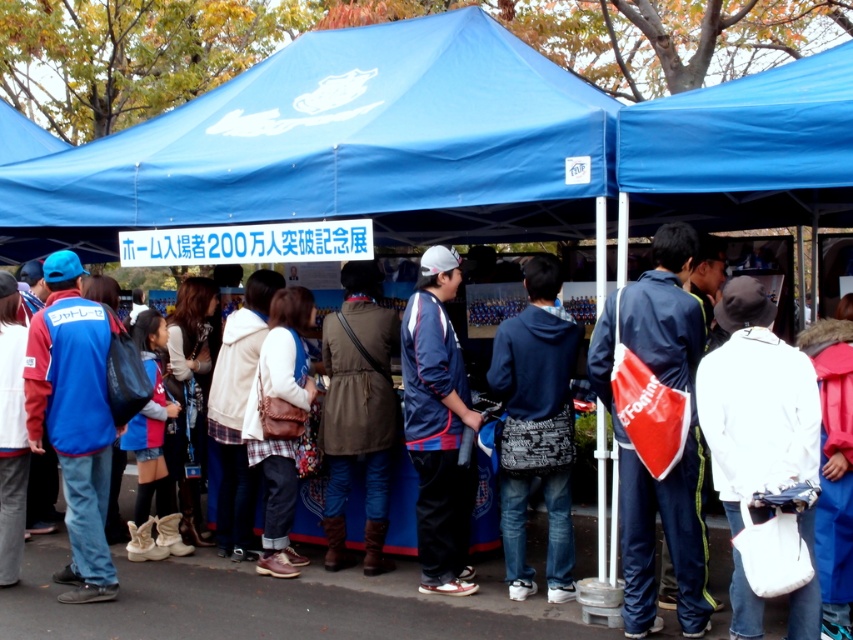
Question: Among these objects, which one is farthest from the camera?

Choices:
 (A) blue fabric canopy at center
 (B) leather brown bag at center
 (C) blue fabric jacket at center

Answer: (B)

Question: Which of these objects is positioned closest to the brown leather jacket at center?

Choices:
 (A) blue fabric jacket at center
 (B) leather brown bag at center
 (C) blue fabric canopy at center

Answer: (B)

Question: Does dark blue hoodie at center have a larger size compared to brown leather jacket at center?

Choices:
 (A) yes
 (B) no

Answer: (B)

Question: Which object is closer to the camera taking this photo?

Choices:
 (A) leather brown bag at center
 (B) blue fabric jacket at left
 (C) white fabric bag at center

Answer: (C)

Question: Is blue fabric canopy at center above brown leather jacket at center?

Choices:
 (A) yes
 (B) no

Answer: (A)

Question: Can you confirm if brown leather jacket at center is positioned to the right of leather brown bag at center?

Choices:
 (A) yes
 (B) no

Answer: (A)